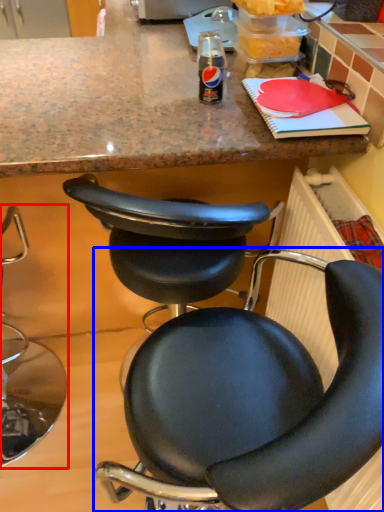
Question: Which of the following is the closest to the observer, chair (highlighted by a red box) or chair (highlighted by a blue box)?

Choices:
 (A) chair
 (B) chair

Answer: (B)